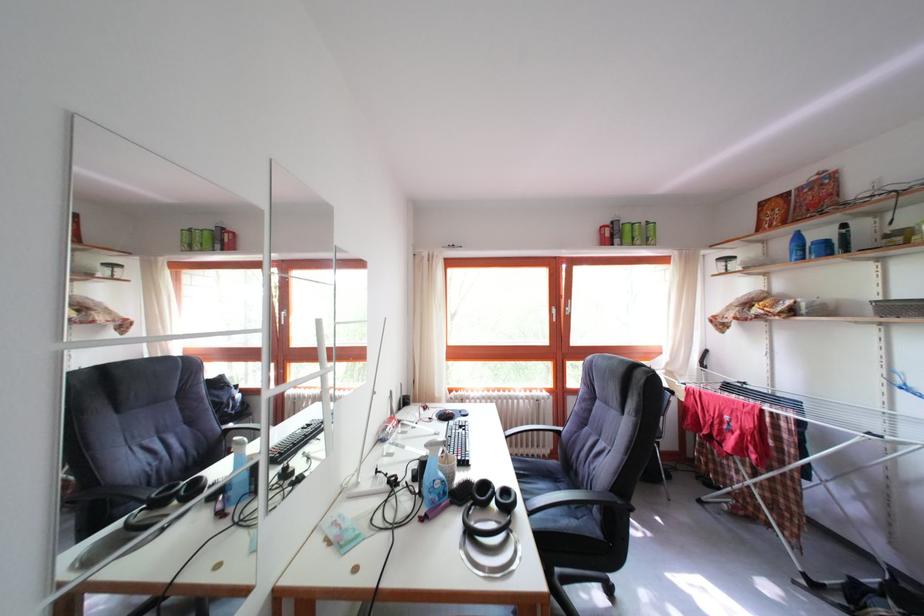
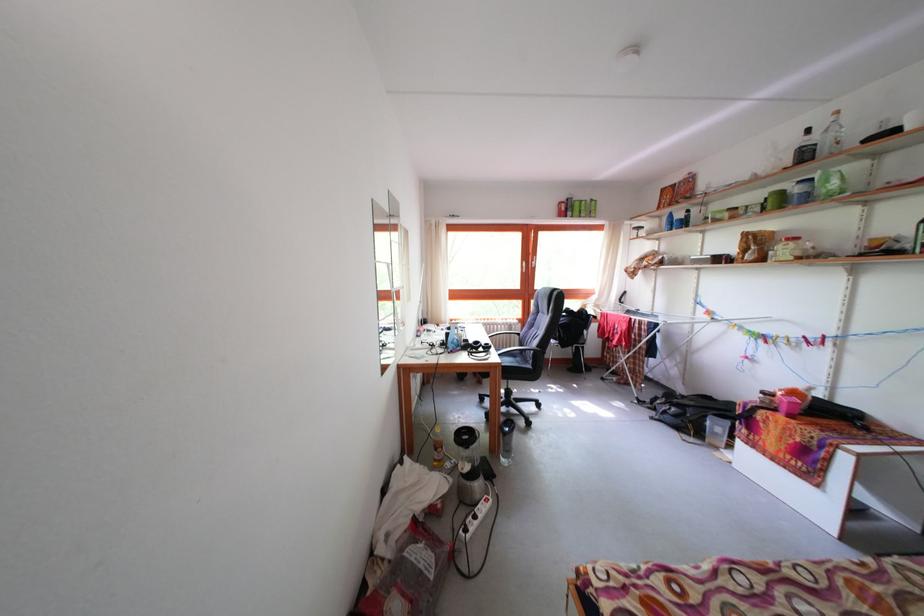
The point at (x=772, y=248) is marked in the first image. Where is the corresponding point in the second image?

(667, 224)